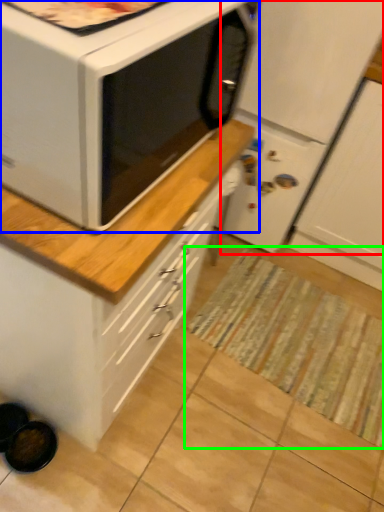
Question: Which object is positioned closest to refrigerator (highlighted by a red box)? Select from microwave oven (highlighted by a blue box) and mat (highlighted by a green box).

Choices:
 (A) microwave oven
 (B) mat

Answer: (A)